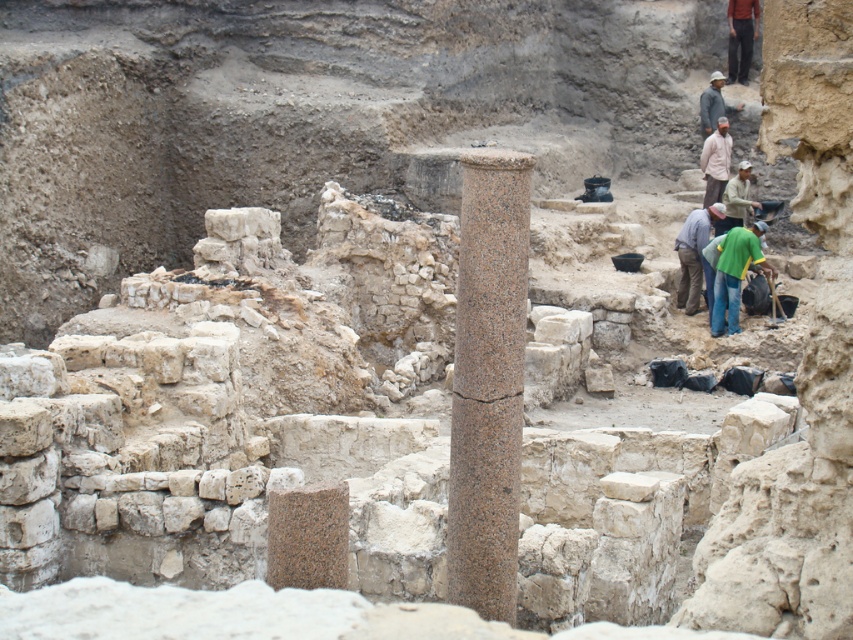
Describe the element at coordinates (734, 273) in the screenshot. I see `green fabric bag at center` at that location.

Between green fabric bag at center and green fabric shirt at upper right, which one is positioned higher?

Positioned higher is green fabric shirt at upper right.

Which is behind, point (721, 284) or point (718, 227)?

Positioned behind is point (718, 227).

At what (x,y) coordinates should I click in order to perform the action: click on green fabric bag at center. Please return your answer as a coordinate pair (x, y). The width and height of the screenshot is (853, 640). Looking at the image, I should click on (734, 273).

The width and height of the screenshot is (853, 640). I want to click on brown cotton shirt at center, so click(715, 161).

Identify the location of brown cotton shirt at center. The height and width of the screenshot is (640, 853). (715, 161).

Locate an element on the screen. This screenshot has width=853, height=640. brown cotton shirt at center is located at coordinates (715, 161).

Who is more distant from viewer, (717, 296) or (706, 230)?

Point (706, 230)

Is point (740, 264) positioned behind point (695, 260)?

No, (740, 264) is in front of (695, 260).

At what (x,y) coordinates should I click in order to perform the action: click on green fabric bag at center. Please return your answer as a coordinate pair (x, y). This screenshot has height=640, width=853. Looking at the image, I should click on (734, 273).

I want to click on green fabric bag at center, so click(x=734, y=273).